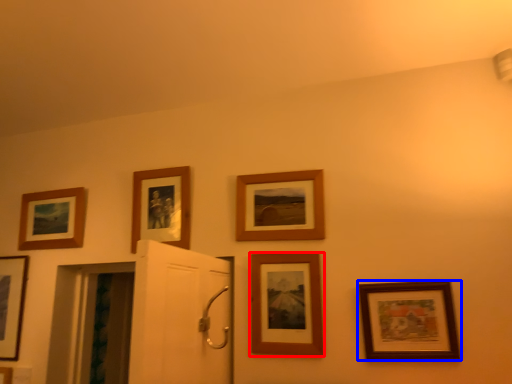
Question: Among these objects, which one is farthest to the camera, picture frame (highlighted by a red box) or picture frame (highlighted by a blue box)?

Choices:
 (A) picture frame
 (B) picture frame

Answer: (A)